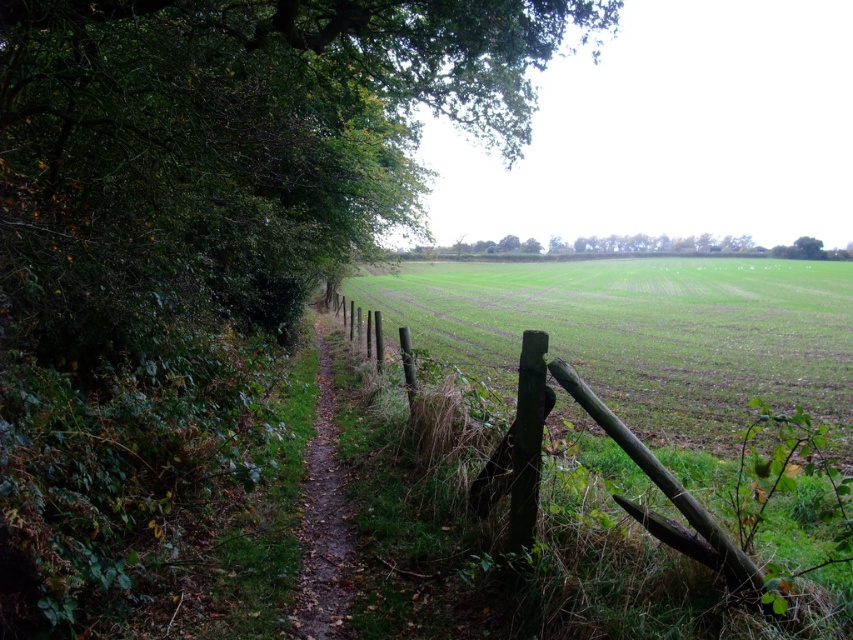
You are a hiker carrying a 2m wide tent. You need to set up camp along the narrow dirt path. Considering the weathered wood fence at center and the green leafy tree at center, which object would allow you to safely place your tent without blocking the path?

The green leafy tree at center has a wider width than the weathered wood fence at center. Since the tent is 2m wide, you should place it next to the green leafy tree at center to ensure enough space without obstructing the path.